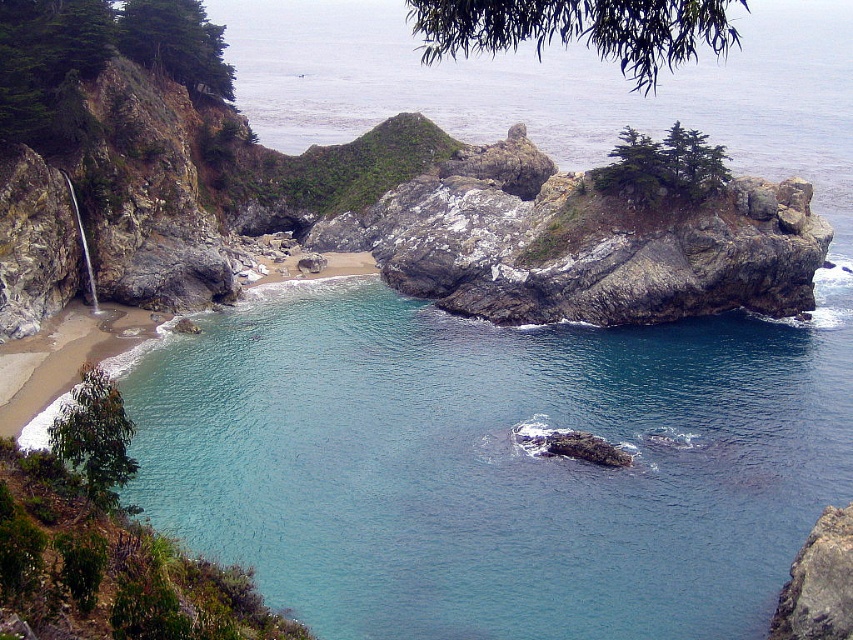
You are standing on the shore of the cove and want to reach the clear blue water at center. Based on the coordinates provided, in which direction should you walk from your current position?

The clear blue water at center is located at coordinates point (x=494, y=461), which means it is positioned to the right and slightly forward from your current position on the shore. You should walk towards the right and forward to reach it.

You are a kayaker planning to navigate through the clear blue water at center and the rocky cliff at lower right. Which area should you avoid due to potential submerged rocks?

You should avoid the rocky cliff at lower right because it is partially submerged and has more rocks, making it dangerous for kayaking.

You are standing on the beach and want to take a photo of both the clear blue water at center and the rocky cliff at lower right. Which object should you focus on first to ensure both are in frame?

You should focus on the clear blue water at center first because it is closer to you than the rocky cliff at lower right, so adjusting the camera to include both would require ensuring the closer object is framed properly before the distant one.